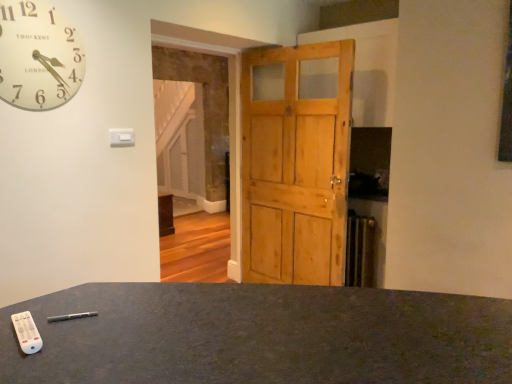
Question: Should I look upward or downward to see matte black desk at lower center?

Choices:
 (A) down
 (B) up

Answer: (A)

Question: Is natural wood barn door at center located outside matte black desk at lower center?

Choices:
 (A) yes
 (B) no

Answer: (A)

Question: Is matte black desk at lower center at the back of natural wood barn door at center?

Choices:
 (A) no
 (B) yes

Answer: (A)

Question: Are natural wood barn door at center and matte black desk at lower center beside each other?

Choices:
 (A) no
 (B) yes

Answer: (A)

Question: Is natural wood barn door at center at the left side of matte black desk at lower center?

Choices:
 (A) no
 (B) yes

Answer: (A)

Question: Does natural wood barn door at center have a greater height compared to matte black desk at lower center?

Choices:
 (A) no
 (B) yes

Answer: (B)

Question: Is natural wood barn door at center to the right of matte black desk at lower center from the viewer's perspective?

Choices:
 (A) yes
 (B) no

Answer: (A)

Question: Is white plastic remote at lower left located outside natural wood barn door at center?

Choices:
 (A) yes
 (B) no

Answer: (A)

Question: Is white plastic remote at lower left facing away from natural wood barn door at center?

Choices:
 (A) no
 (B) yes

Answer: (A)

Question: Could you tell me if white plastic remote at lower left is facing natural wood barn door at center?

Choices:
 (A) yes
 (B) no

Answer: (B)

Question: Is the position of white plastic remote at lower left more distant than that of natural wood barn door at center?

Choices:
 (A) yes
 (B) no

Answer: (B)

Question: From a real-world perspective, is white plastic remote at lower left below natural wood barn door at center?

Choices:
 (A) no
 (B) yes

Answer: (B)

Question: Does white plastic remote at lower left appear on the right side of natural wood barn door at center?

Choices:
 (A) yes
 (B) no

Answer: (B)

Question: Is matte black desk at lower center to the left of natural wood barn door at center from the viewer's perspective?

Choices:
 (A) yes
 (B) no

Answer: (A)